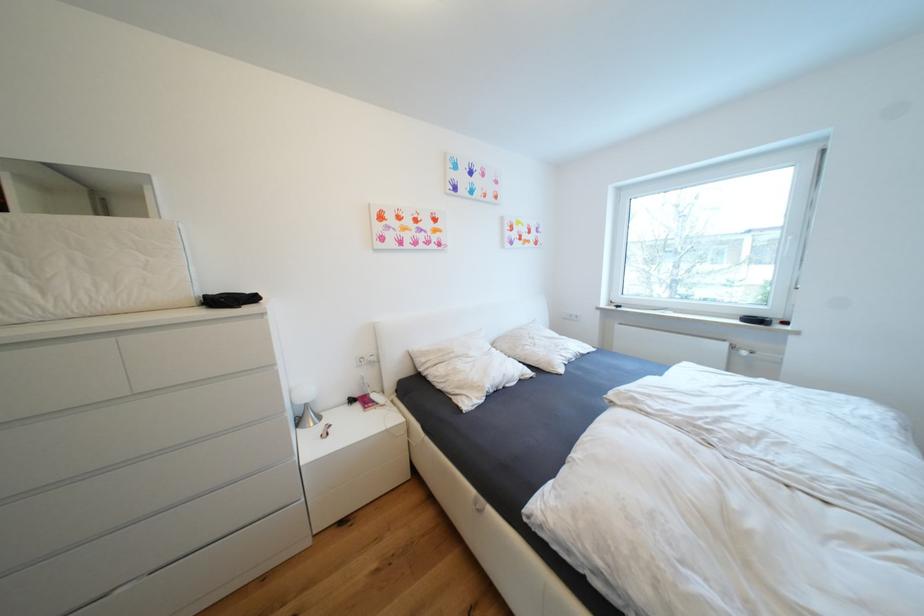
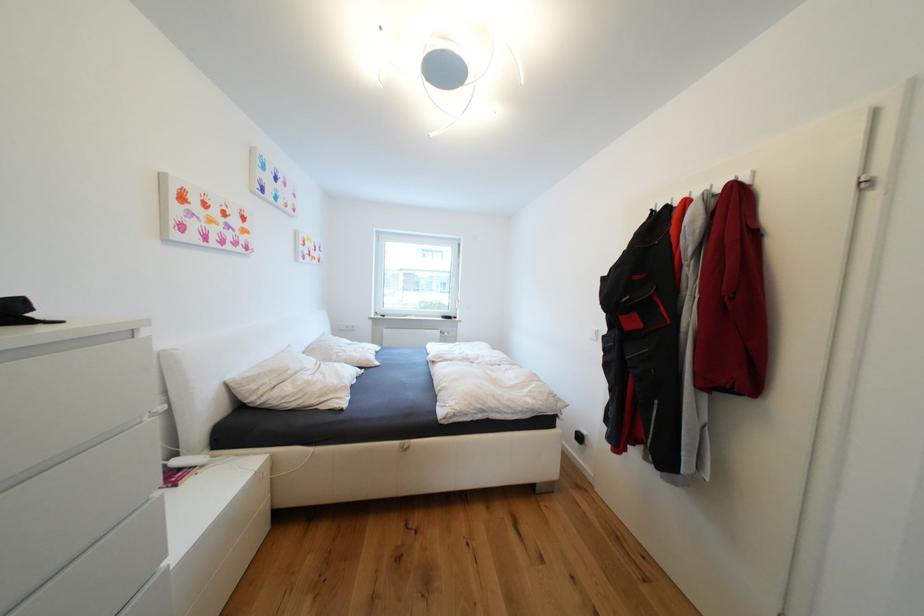
The point at [381,398] is marked in the first image. Where is the corresponding point in the second image?

(184, 464)